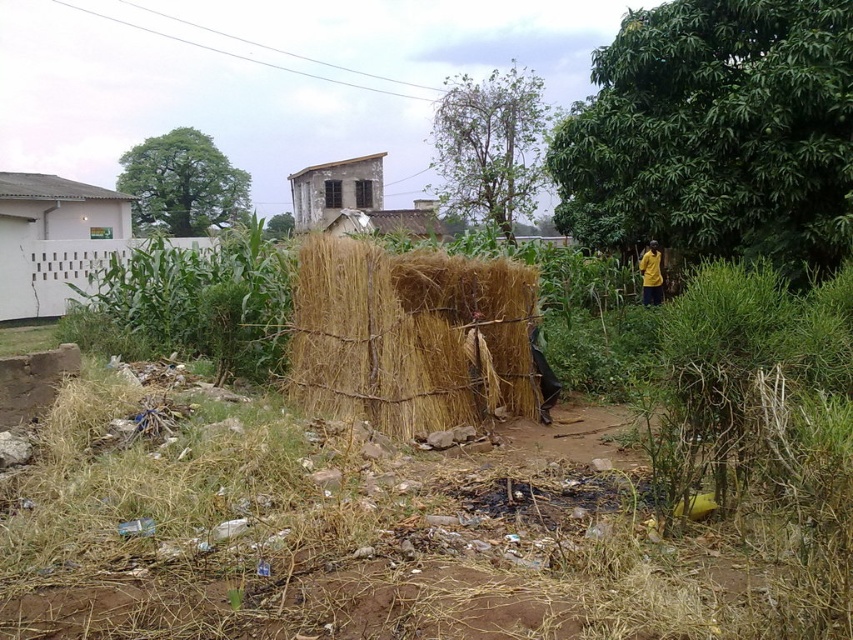
You are standing at the edge of the scene and want to reach the weathered wooden hut at center. There is a dry straw bale at center blocking your path. Can you walk around it to the left or right?

The dry straw bale at center is in front of the weathered wooden hut at center, so you can walk around it either to the left or right to reach the weathered wooden hut at center.